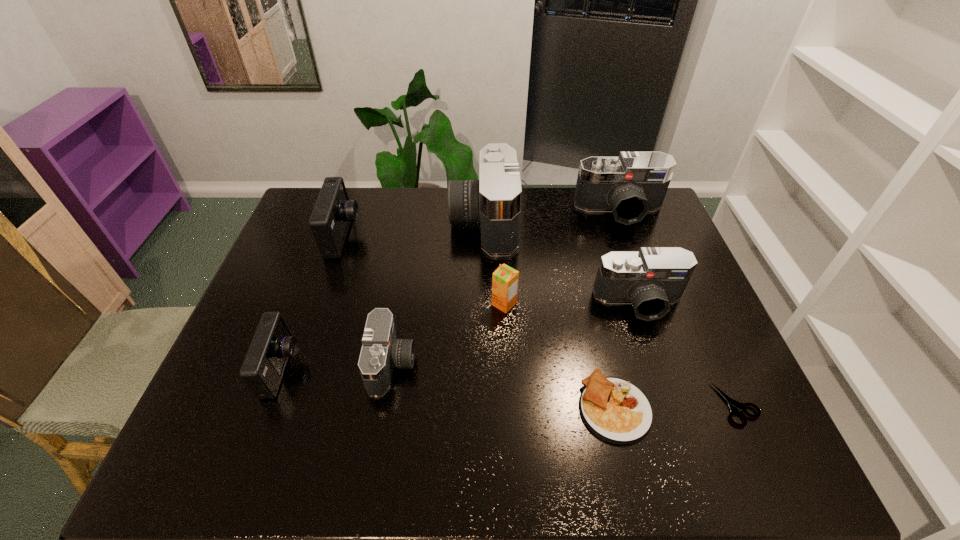
Where is `vacant space in between the shortest object and the nearer blue camera`? This screenshot has width=960, height=540. vacant space in between the shortest object and the nearer blue camera is located at coordinates (510, 387).

Identify the location of object that stands as the second closest to the orange juice. The width and height of the screenshot is (960, 540). (381, 352).

Where is `object that is the third closest to the third smallest black camera`? The height and width of the screenshot is (540, 960). object that is the third closest to the third smallest black camera is located at coordinates (505, 279).

Locate which camera ranks third in proximity to the third object from left to right. Please provide its 2D coordinates. Your answer should be formatted as a tuple, i.e. [(x, y)], where the tuple contains the x and y coordinates of a point satisfying the conditions above.

[(494, 201)]

The height and width of the screenshot is (540, 960). In order to click on the third closest camera to the third farthest black camera in this screenshot , I will do `click(381, 352)`.

Where is `black camera that can be found as the closest to the fourth farthest camera`? black camera that can be found as the closest to the fourth farthest camera is located at coordinates (494, 201).

In order to click on black camera object that ranks as the third closest to the second smallest black camera in this screenshot , I will do `click(381, 352)`.

At what (x,y) coordinates should I click in order to perform the action: click on free location that satisfies the following two spatial constraints: 1. on the back side of the eighth tallest object; 2. on the front-facing side of the smaller blue camera. Please return your answer as a coordinate pair (x, y). The image size is (960, 540). Looking at the image, I should click on (606, 369).

The width and height of the screenshot is (960, 540). I want to click on vacant space that satisfies the following two spatial constraints: 1. on the front-facing side of the third black camera from right to left; 2. on the back side of the orange juice, so click(x=484, y=304).

At what (x,y) coordinates should I click in order to perform the action: click on free spot that satisfies the following two spatial constraints: 1. on the front-facing side of the second smallest black camera; 2. on the front-facing side of the nearer blue camera. Please return your answer as a coordinate pair (x, y). This screenshot has width=960, height=540. Looking at the image, I should click on (662, 369).